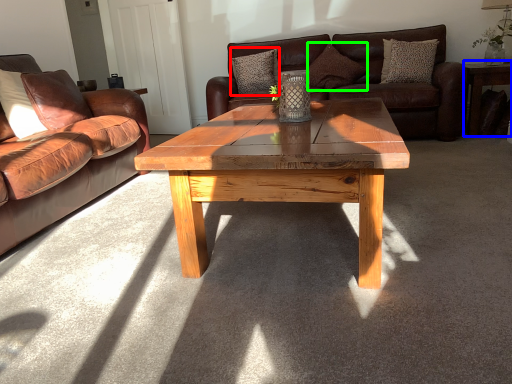
Question: Which object is positioned farthest from pillow (highlighted by a red box)? Select from side table (highlighted by a blue box) and pillow (highlighted by a green box).

Choices:
 (A) side table
 (B) pillow

Answer: (A)